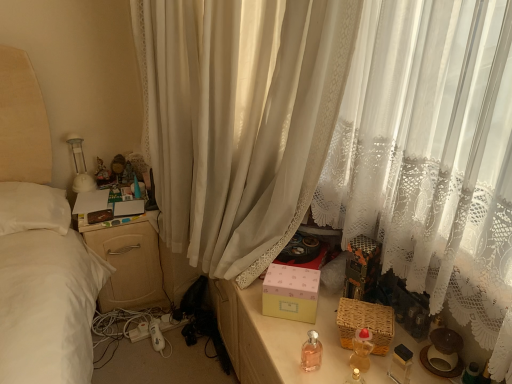
I want to click on empty space that is ontop of beige wood nightstand at left (from a real-world perspective), so click(x=112, y=190).